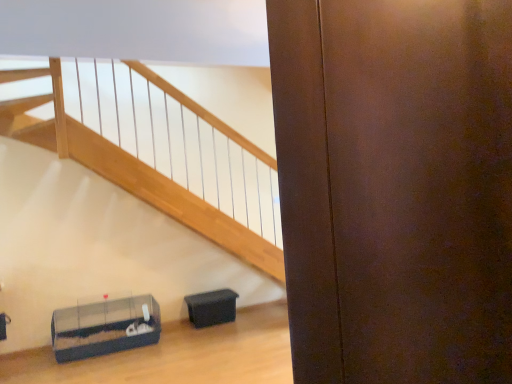
Where is `black plastic container at lower center, placed as the 2th furniture when sorted from left to right`? The height and width of the screenshot is (384, 512). black plastic container at lower center, placed as the 2th furniture when sorted from left to right is located at coordinates (211, 307).

Based on the photo, in order to face black plastic container at lower center, the 1th furniture viewed from the right, should I rotate leftwards or rightwards?

Turn left approximately 5.939 degrees to face it.

What is the approximate height of black plastic container at lower center, placed as the 2th furniture when sorted from left to right?

The height of black plastic container at lower center, placed as the 2th furniture when sorted from left to right, is 12.35 inches.

What do you see at coordinates (211, 307) in the screenshot?
I see `black plastic container at lower center, the 1th furniture viewed from the right` at bounding box center [211, 307].

This screenshot has height=384, width=512. What do you see at coordinates (105, 327) in the screenshot?
I see `clear plastic cage at lower left, the first furniture when ordered from left to right` at bounding box center [105, 327].

Find the location of a particular element. Image resolution: width=512 pixels, height=384 pixels. clear plastic cage at lower left, which appears as the 2th furniture when viewed from the right is located at coordinates (105, 327).

Locate an element on the screen. This screenshot has width=512, height=384. black plastic container at lower center, the 1th furniture viewed from the right is located at coordinates (211, 307).

Can you confirm if black plastic container at lower center, placed as the 2th furniture when sorted from left to right, is positioned to the left of clear plastic cage at lower left, the first furniture when ordered from left to right?

Incorrect, black plastic container at lower center, placed as the 2th furniture when sorted from left to right, is not on the left side of clear plastic cage at lower left, the first furniture when ordered from left to right.

Is the position of black plastic container at lower center, placed as the 2th furniture when sorted from left to right, more distant than that of clear plastic cage at lower left, the first furniture when ordered from left to right?

Yes, black plastic container at lower center, placed as the 2th furniture when sorted from left to right, is further from the camera.

Which is more distant, (222,307) or (159,323)?

Point (222,307)

From the image's perspective, between black plastic container at lower center, the 1th furniture viewed from the right, and clear plastic cage at lower left, the first furniture when ordered from left to right, which one is located above?

black plastic container at lower center, the 1th furniture viewed from the right, from the image's perspective.

From a real-world perspective, which object stands above the other?

clear plastic cage at lower left, which appears as the 2th furniture when viewed from the right.

Between black plastic container at lower center, the 1th furniture viewed from the right, and clear plastic cage at lower left, the first furniture when ordered from left to right, which one has smaller width?

With smaller width is black plastic container at lower center, the 1th furniture viewed from the right.

Who is shorter, black plastic container at lower center, placed as the 2th furniture when sorted from left to right, or clear plastic cage at lower left, which appears as the 2th furniture when viewed from the right?

With less height is black plastic container at lower center, placed as the 2th furniture when sorted from left to right.

Is black plastic container at lower center, the 1th furniture viewed from the right, smaller than clear plastic cage at lower left, the first furniture when ordered from left to right?

Yes.

Is clear plastic cage at lower left, which appears as the 2th furniture when viewed from the right, surrounded by black plastic container at lower center, the 1th furniture viewed from the right?

That's incorrect, clear plastic cage at lower left, which appears as the 2th furniture when viewed from the right, is not inside black plastic container at lower center, the 1th furniture viewed from the right.

Are black plastic container at lower center, placed as the 2th furniture when sorted from left to right, and clear plastic cage at lower left, the first furniture when ordered from left to right, making contact?

No.

Does black plastic container at lower center, placed as the 2th furniture when sorted from left to right, turn towards clear plastic cage at lower left, which appears as the 2th furniture when viewed from the right?

No, black plastic container at lower center, placed as the 2th furniture when sorted from left to right, is not facing towards clear plastic cage at lower left, which appears as the 2th furniture when viewed from the right.

The height and width of the screenshot is (384, 512). I want to click on furniture behind the clear plastic cage at lower left, which appears as the 2th furniture when viewed from the right, so click(211, 307).

In the image, is clear plastic cage at lower left, which appears as the 2th furniture when viewed from the right, on the left side or the right side of black plastic container at lower center, placed as the 2th furniture when sorted from left to right?

Clearly, clear plastic cage at lower left, which appears as the 2th furniture when viewed from the right, is on the left of black plastic container at lower center, placed as the 2th furniture when sorted from left to right, in the image.

Is clear plastic cage at lower left, the first furniture when ordered from left to right, positioned behind black plastic container at lower center, the 1th furniture viewed from the right?

No, it is not.

Which point is more forward, (125,334) or (190,297)?

The point (125,334) is closer.

From the image's perspective, is clear plastic cage at lower left, which appears as the 2th furniture when viewed from the right, located above or below black plastic container at lower center, the 1th furniture viewed from the right?

clear plastic cage at lower left, which appears as the 2th furniture when viewed from the right, is situated lower than black plastic container at lower center, the 1th furniture viewed from the right, in the image.

From a real-world perspective, is clear plastic cage at lower left, the first furniture when ordered from left to right, over black plastic container at lower center, placed as the 2th furniture when sorted from left to right?

Yes, from a real-world perspective, clear plastic cage at lower left, the first furniture when ordered from left to right, is over black plastic container at lower center, placed as the 2th furniture when sorted from left to right

Looking at their sizes, would you say clear plastic cage at lower left, the first furniture when ordered from left to right, is wider or thinner than black plastic container at lower center, placed as the 2th furniture when sorted from left to right?

Considering their sizes, clear plastic cage at lower left, the first furniture when ordered from left to right, looks broader than black plastic container at lower center, placed as the 2th furniture when sorted from left to right.

Who is shorter, clear plastic cage at lower left, the first furniture when ordered from left to right, or black plastic container at lower center, the 1th furniture viewed from the right?

black plastic container at lower center, the 1th furniture viewed from the right.

Is clear plastic cage at lower left, which appears as the 2th furniture when viewed from the right, bigger or smaller than black plastic container at lower center, the 1th furniture viewed from the right?

Considering their sizes, clear plastic cage at lower left, which appears as the 2th furniture when viewed from the right, takes up more space than black plastic container at lower center, the 1th furniture viewed from the right.

Is black plastic container at lower center, placed as the 2th furniture when sorted from left to right, a part of clear plastic cage at lower left, the first furniture when ordered from left to right?

No, clear plastic cage at lower left, the first furniture when ordered from left to right, does not contain black plastic container at lower center, placed as the 2th furniture when sorted from left to right.

In the scene shown: Is clear plastic cage at lower left, the first furniture when ordered from left to right, not close to black plastic container at lower center, the 1th furniture viewed from the right?

clear plastic cage at lower left, the first furniture when ordered from left to right, is actually quite close to black plastic container at lower center, the 1th furniture viewed from the right.

Consider the image. Could you tell me if clear plastic cage at lower left, the first furniture when ordered from left to right, is facing black plastic container at lower center, the 1th furniture viewed from the right?

No, clear plastic cage at lower left, the first furniture when ordered from left to right, is not aimed at black plastic container at lower center, the 1th furniture viewed from the right.

The width and height of the screenshot is (512, 384). Find the location of `furniture below the black plastic container at lower center, placed as the 2th furniture when sorted from left to right (from the image's perspective)`. furniture below the black plastic container at lower center, placed as the 2th furniture when sorted from left to right (from the image's perspective) is located at coordinates (105, 327).

Locate an element on the screen. furniture in front of the black plastic container at lower center, placed as the 2th furniture when sorted from left to right is located at coordinates (105, 327).

Where is `furniture on the right of clear plastic cage at lower left, the first furniture when ordered from left to right`? Image resolution: width=512 pixels, height=384 pixels. furniture on the right of clear plastic cage at lower left, the first furniture when ordered from left to right is located at coordinates pos(211,307).